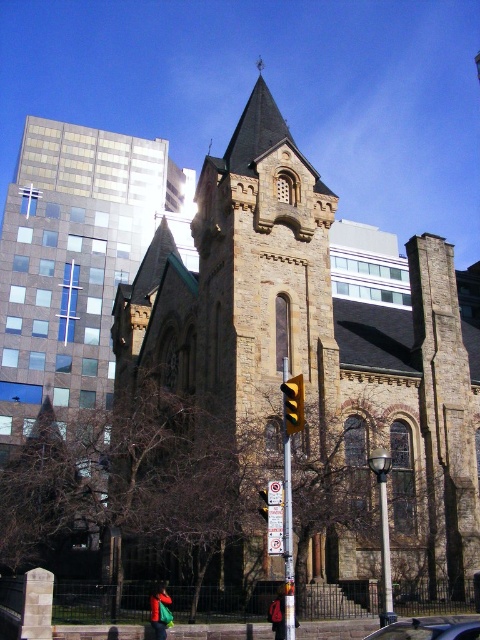
Question: In this image, where is metallic silver car at center located relative to yellow matte traffic light at center?

Choices:
 (A) below
 (B) above

Answer: (A)

Question: Does brown stone church at center have a greater width compared to yellow matte traffic light at center?

Choices:
 (A) no
 (B) yes

Answer: (B)

Question: Which is farther from the brown stone church at center?

Choices:
 (A) metallic silver car at center
 (B) yellow matte traffic light at center

Answer: (A)

Question: Which point is closer to the camera taking this photo?

Choices:
 (A) (301, 410)
 (B) (288, 228)
 (C) (477, 620)

Answer: (A)

Question: Which object is positioned farthest from the brown stone church at center?

Choices:
 (A) yellow matte traffic light at center
 (B) metallic silver car at center

Answer: (B)

Question: Can you confirm if brown stone church at center is thinner than yellow matte traffic light at center?

Choices:
 (A) yes
 (B) no

Answer: (B)